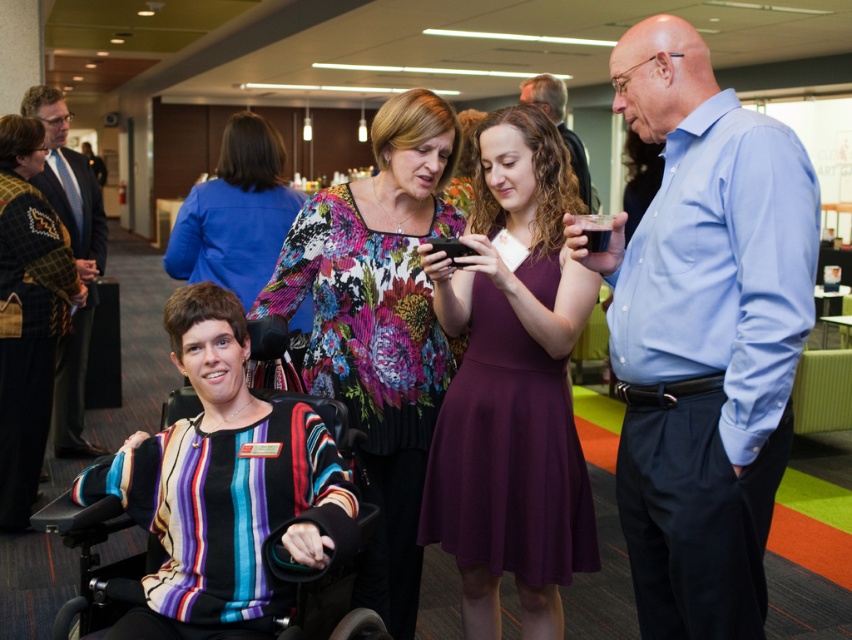
Question: Can you confirm if blue shirt at upper center is smaller than black matte smartphone at center?

Choices:
 (A) no
 (B) yes

Answer: (A)

Question: Estimate the real-world distances between objects in this image. Which object is closer to the floral print blouse at center?

Choices:
 (A) blue shirt at center
 (B) purple satin dress at center
 (C) dark blue suit at left
 (D) blue shirt at upper center

Answer: (C)

Question: Is blue shirt at center to the left of blue shirt at upper center from the viewer's perspective?

Choices:
 (A) yes
 (B) no

Answer: (A)

Question: Does purple satin dress at center come in front of floral print blouse at center?

Choices:
 (A) no
 (B) yes

Answer: (B)

Question: Which point is farther to the camera?

Choices:
 (A) black plastic wheelchair at left
 (B) purple satin dress at center

Answer: (B)

Question: Which is farther from the blue shirt at center?

Choices:
 (A) dark blue suit at left
 (B) blue shirt at upper center
 (C) floral print blouse at center
 (D) black matte smartphone at center

Answer: (A)